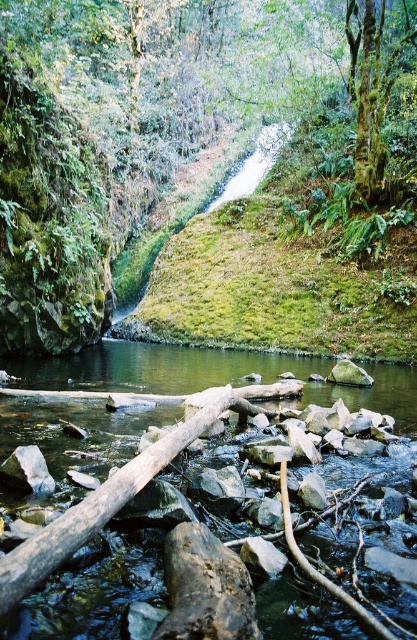
Question: Estimate the real-world distances between objects in this image. Which object is farther from the smooth brown river at center?

Choices:
 (A) white smooth rock at center
 (B) gray rock at center

Answer: (B)

Question: Considering the real-world distances, which object is closest to the white smooth rock at center?

Choices:
 (A) gray rock at center
 (B) smooth brown river at center

Answer: (B)

Question: Is smooth brown river at center smaller than white smooth rock at center?

Choices:
 (A) yes
 (B) no

Answer: (B)

Question: Is smooth brown river at center below gray rock at center?

Choices:
 (A) no
 (B) yes

Answer: (B)

Question: Among these points, which one is farthest from the camera?

Choices:
 (A) (25, 467)
 (B) (351, 371)
 (C) (341, 538)

Answer: (B)

Question: Does smooth brown river at center appear over white smooth rock at center?

Choices:
 (A) yes
 (B) no

Answer: (A)